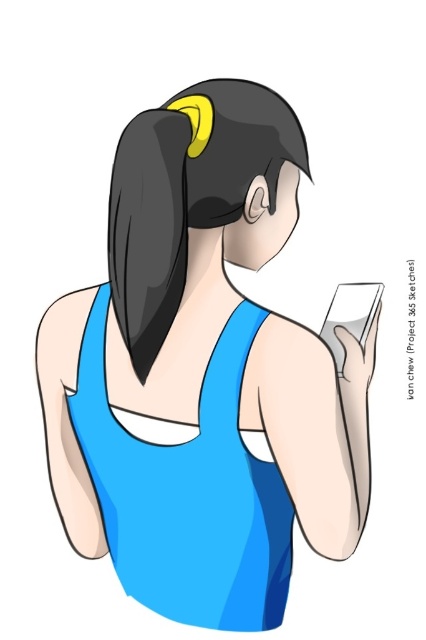
Question: Which point appears closest to the camera in this image?

Choices:
 (A) (74, 496)
 (B) (152, 560)

Answer: (B)

Question: Observing the image, what is the correct spatial positioning of black shiny hair at upper center in reference to black matte hair at upper center?

Choices:
 (A) left
 (B) right

Answer: (B)

Question: Does blue matte dress at center have a lesser width compared to black shiny hair at upper center?

Choices:
 (A) no
 (B) yes

Answer: (A)

Question: Which object appears closest to the camera in this image?

Choices:
 (A) blue matte dress at center
 (B) matte blue tank top at center
 (C) matte white phone at upper right

Answer: (B)

Question: Among these objects, which one is farthest from the camera?

Choices:
 (A) matte blue tank top at center
 (B) blue matte dress at center

Answer: (B)

Question: Does matte blue tank top at center appear over black matte hair at upper center?

Choices:
 (A) no
 (B) yes

Answer: (A)